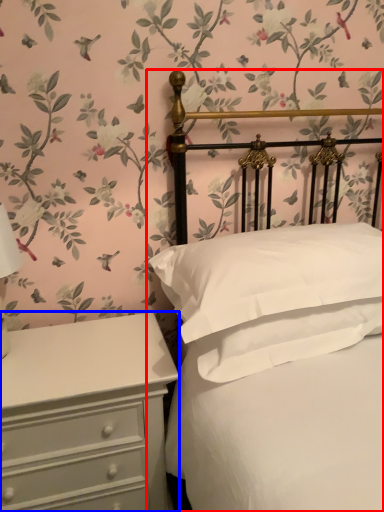
Question: Which object is closer to the camera taking this photo, bed (highlighted by a red box) or chest of drawers (highlighted by a blue box)?

Choices:
 (A) bed
 (B) chest of drawers

Answer: (A)